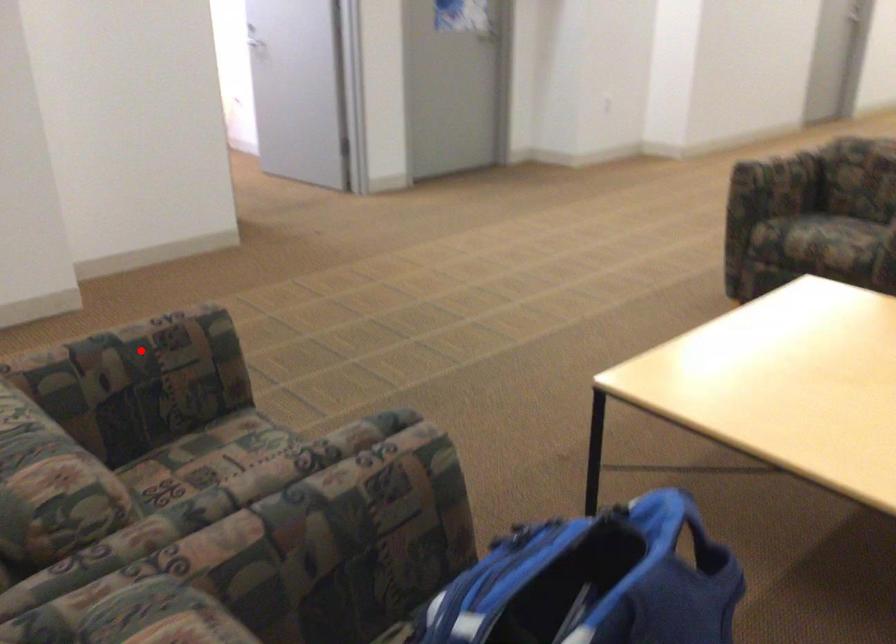
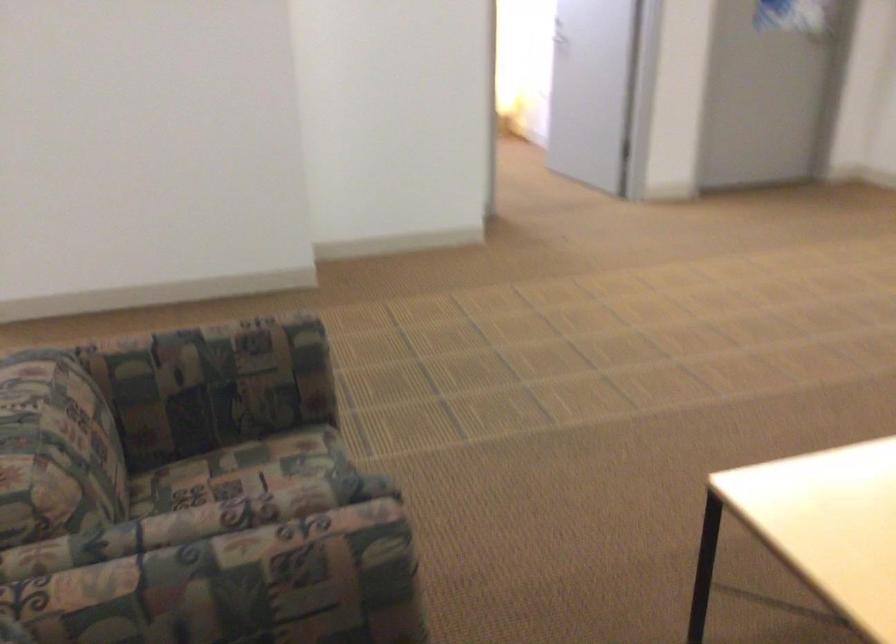
In the second image, find the point that corresponds to the highlighted location in the first image.

(218, 351)